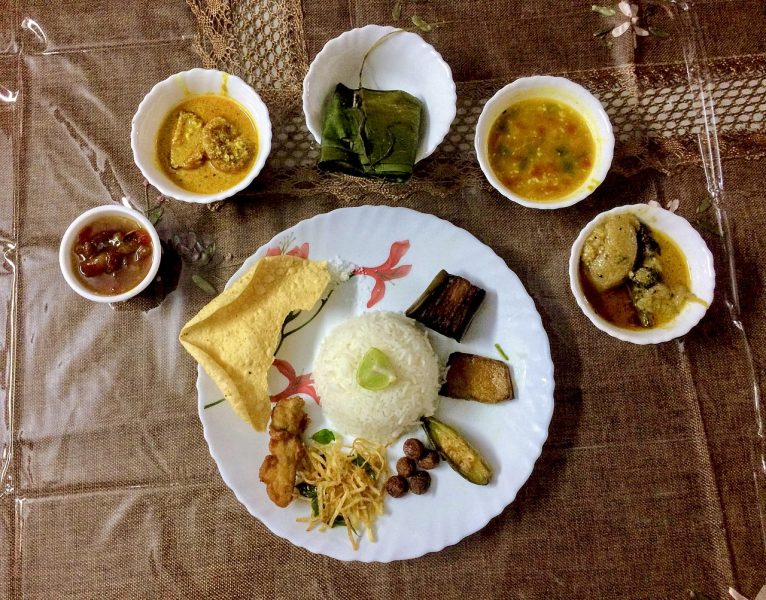
Locate an element on the screen. The height and width of the screenshot is (600, 766). tablecloth is located at coordinates (87, 387).